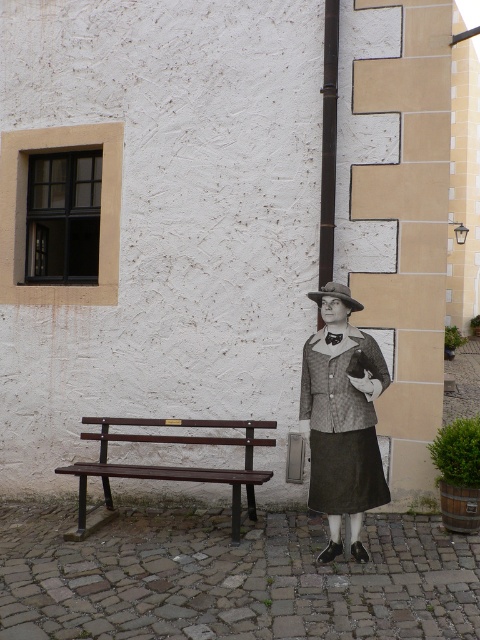
Is matte gray fabric coat at center further to the viewer compared to dark brown wood pole at center?

No, it is in front of dark brown wood pole at center.

The height and width of the screenshot is (640, 480). Describe the element at coordinates (342, 419) in the screenshot. I see `matte gray fabric coat at center` at that location.

The width and height of the screenshot is (480, 640). Describe the element at coordinates (342, 419) in the screenshot. I see `matte gray fabric coat at center` at that location.

Where is `matte gray fabric coat at center`? Image resolution: width=480 pixels, height=640 pixels. matte gray fabric coat at center is located at coordinates (342, 419).

Which is more to the right, matte gray fabric coat at center or brown felt hat at center?

matte gray fabric coat at center

Based on the photo, is the position of matte gray fabric coat at center less distant than that of brown felt hat at center?

That is True.

Measure the distance between matte gray fabric coat at center and camera.

17.04 feet

The image size is (480, 640). What are the coordinates of `matte gray fabric coat at center` in the screenshot? It's located at (342, 419).

Who is higher up, dark brown wood pole at center or brown felt hat at center?

dark brown wood pole at center

Is dark brown wood pole at center taller than brown felt hat at center?

Correct, dark brown wood pole at center is much taller as brown felt hat at center.

Measure the distance between dark brown wood pole at center and camera.

dark brown wood pole at center is 6.54 meters away from camera.

Identify the location of dark brown wood pole at center. (328, 141).